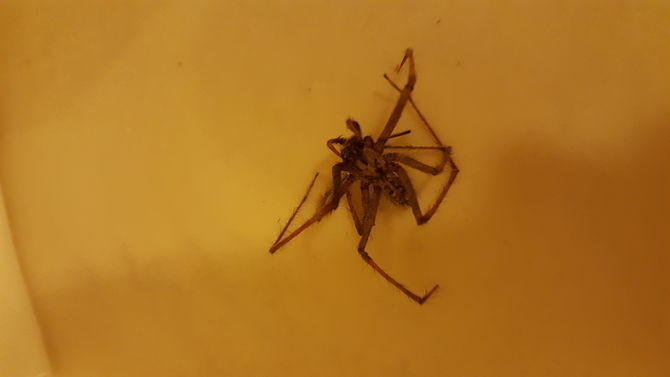
At what (x,y) coordinates should I click in order to perform the action: click on wall. Please return your answer as a coordinate pair (x, y). The image size is (670, 377). Looking at the image, I should click on (135, 183).